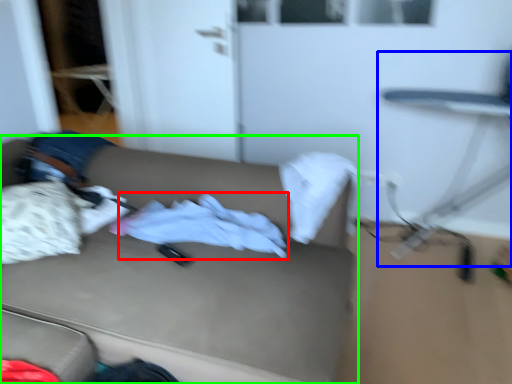
Question: Estimate the real-world distances between objects in this image. Which object is closer to baby clothe (highlighted by a red box), swivel chair (highlighted by a blue box) or studio couch (highlighted by a green box)?

Choices:
 (A) swivel chair
 (B) studio couch

Answer: (B)